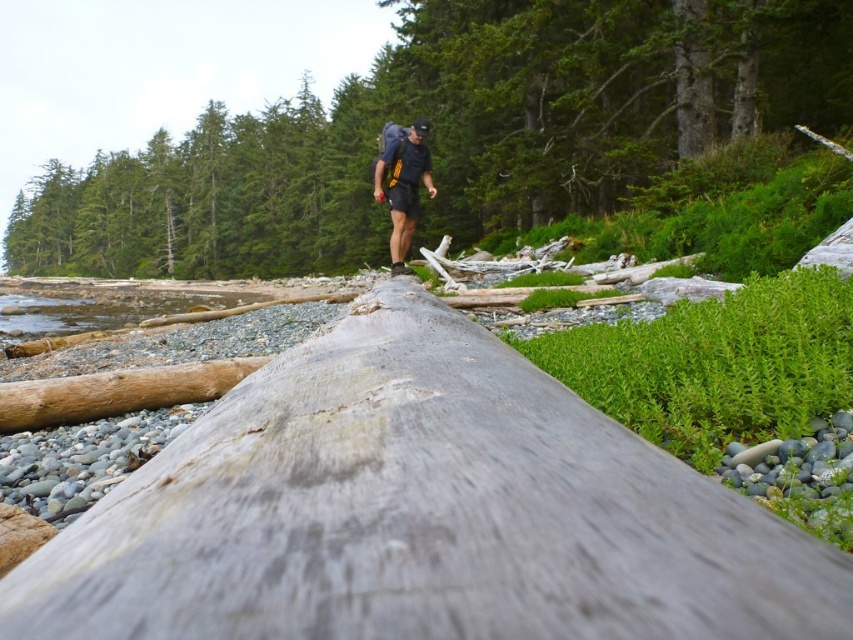
You are a hiker who wants to place your matte black backpack at center on top of the weathered gray log at center. Is this possible based on their positions?

The weathered gray log at center is positioned under matte black backpack at center, so the backpack is already resting on the log. Therefore, placing it there is possible.

You are a hiker who wants to place your matte black backpack at center on top of the smooth gray log at center. Based on the scene, will the backpack fit on top of the log?

The smooth gray log at center is much taller than the matte black backpack at center, so the backpack will fit on top of the log since the log has sufficient height to support it.

You are a hiker who has just arrived at the beach area. You see the weathered gray log at center and the matte black backpack at center. If you want to place your new backpack that is 1.5 meters long on the log, will it fit?

The distance between weathered gray log at center and matte black backpack at center is 7.58 meters. Since the backpack is only 1.5 meters long, it will easily fit on the log.